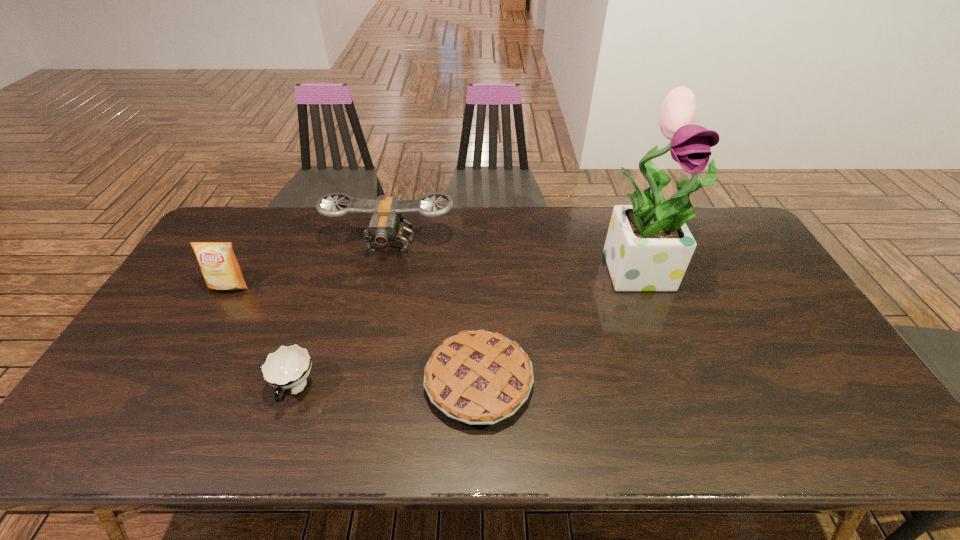
Locate an element on the screen. Image resolution: width=960 pixels, height=540 pixels. the rightmost object is located at coordinates (648, 247).

Where is `flower arrangement`? This screenshot has width=960, height=540. flower arrangement is located at coordinates (648, 247).

This screenshot has height=540, width=960. Find the location of `drone`. drone is located at coordinates (386, 225).

Where is `the leftmost object`? the leftmost object is located at coordinates (219, 266).

I want to click on the second shortest object, so click(287, 368).

In order to click on the shortest object in this screenshot , I will do [478, 377].

Identify the location of vacant space located on the front-facing side of the flower arrangement. This screenshot has height=540, width=960. (703, 419).

The image size is (960, 540). What are the coordinates of `free space located 0.210m on the front-facing side of the drone` in the screenshot? It's located at (374, 314).

Image resolution: width=960 pixels, height=540 pixels. I want to click on free location located on the front-facing side of the crisp (potato chip), so click(x=198, y=343).

Locate an element on the screen. free spot located 0.070m on the side of the cup with the handle is located at coordinates (276, 445).